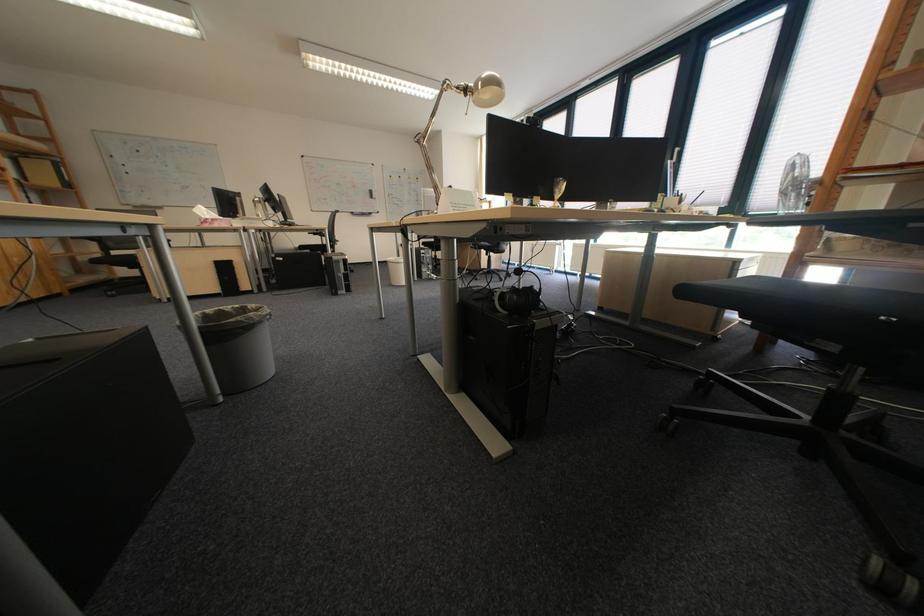
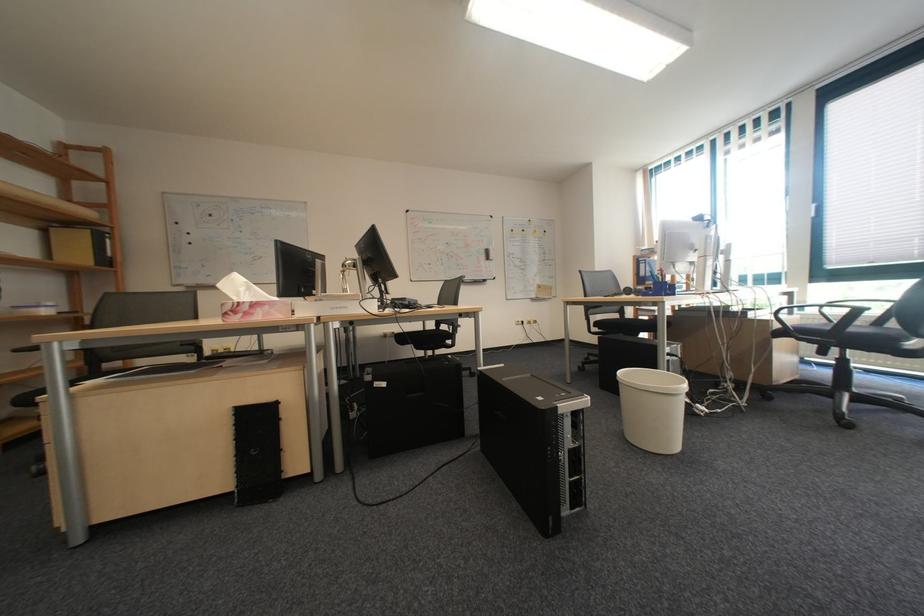
Where in the second image is the point corresponding to (436,246) from the first image?

(609, 328)